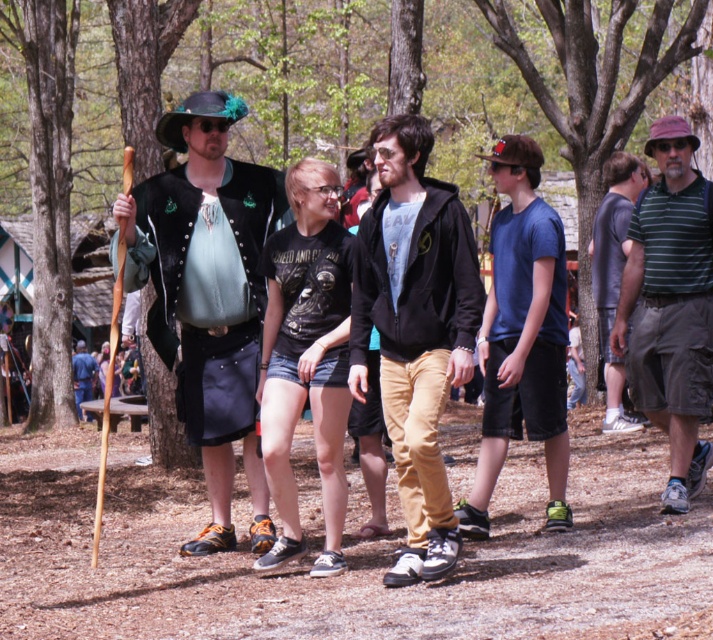
Which of these two, matte black vest at center or black velvety hoodie at center, stands taller?

With more height is matte black vest at center.

Does matte black vest at center appear on the right side of black velvety hoodie at center?

No, matte black vest at center is not to the right of black velvety hoodie at center.

Which is in front, point (222, 276) or point (394, 561)?

Point (394, 561) is in front.

Image resolution: width=713 pixels, height=640 pixels. Identify the location of matte black vest at center. (210, 296).

Does black velvety hoodie at center appear on the right side of blue cotton t-shirt at center?

No, black velvety hoodie at center is not to the right of blue cotton t-shirt at center.

Is black velvety hoodie at center above blue cotton t-shirt at center?

Incorrect, black velvety hoodie at center is not positioned above blue cotton t-shirt at center.

What are the coordinates of `black velvety hoodie at center` in the screenshot? It's located at (415, 330).

Can you confirm if green striped polo shirt at right is positioned above matte black jacket at center?

Yes.

Identify the location of green striped polo shirt at right. (671, 307).

Where is `green striped polo shirt at right`? The height and width of the screenshot is (640, 713). green striped polo shirt at right is located at coordinates coord(671,307).